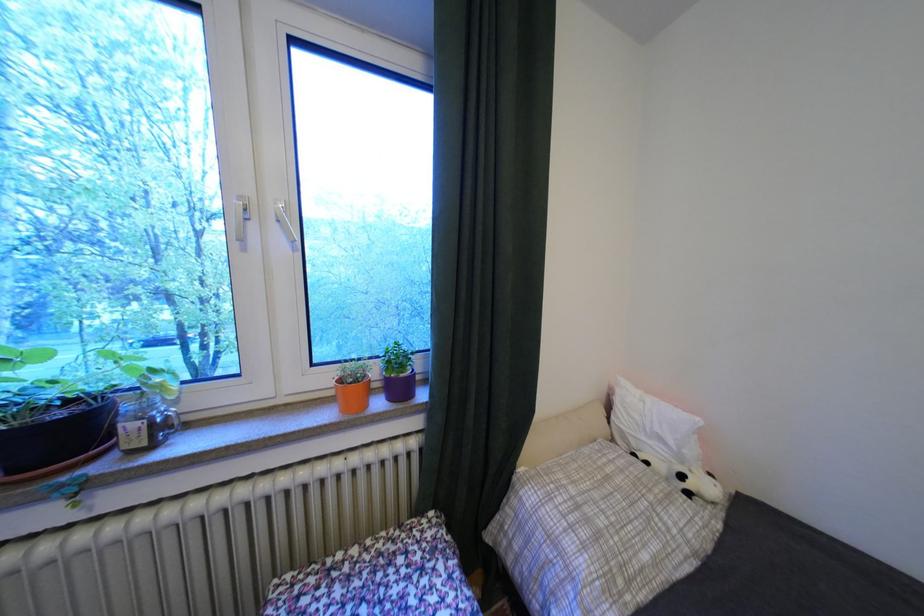
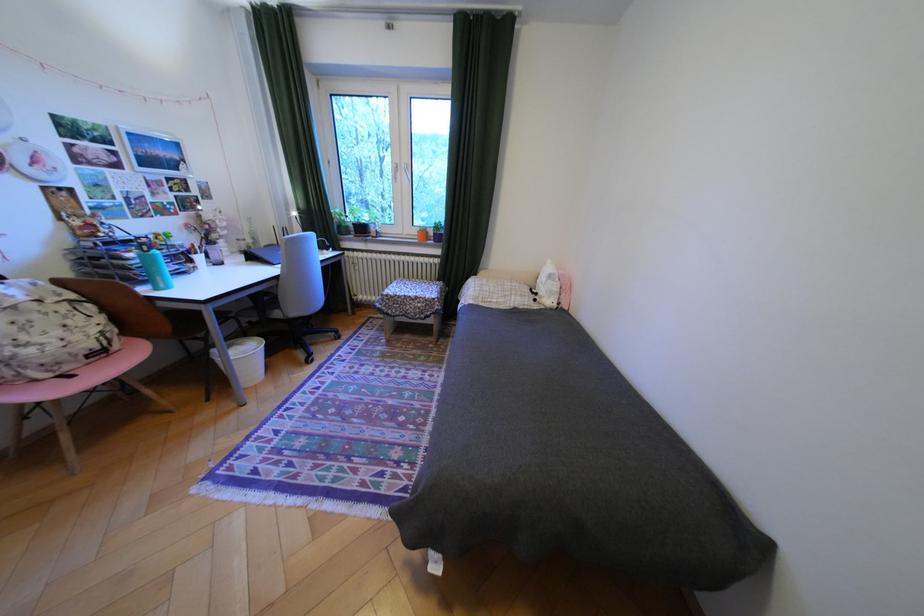
In the second image, find the point that corresponds to (x=264, y=227) in the first image.

(410, 174)